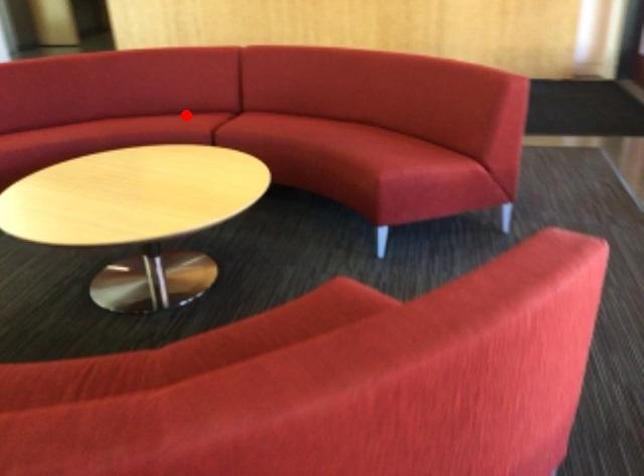
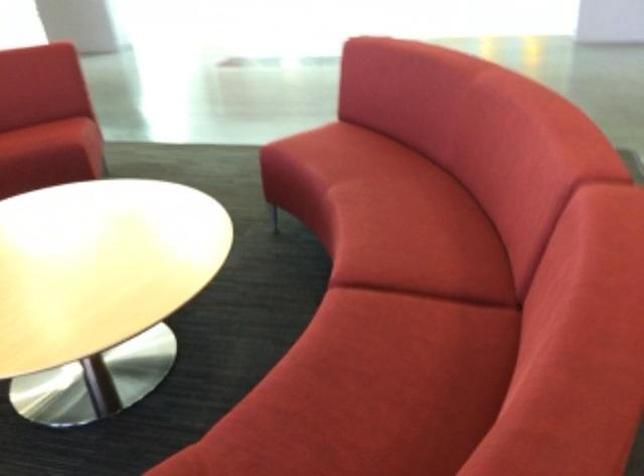
Where in the second image is the point corresponding to the highlighted location from the first image?

(418, 239)